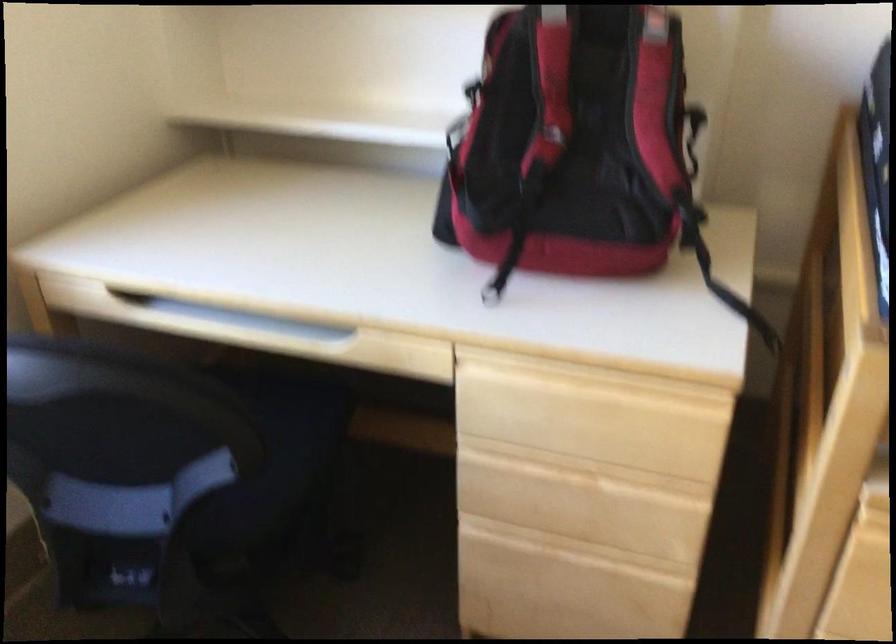
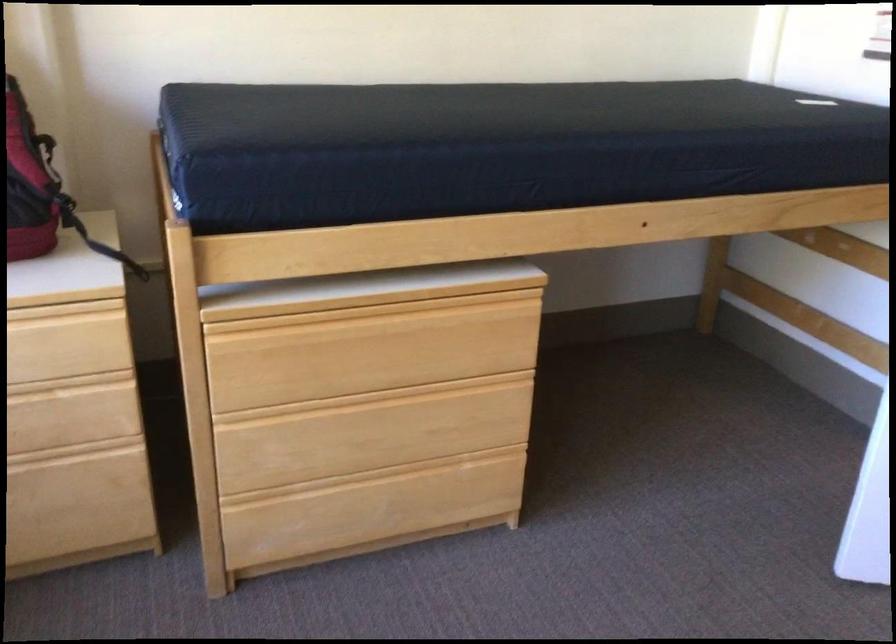
Locate, in the second image, the point that corresponds to (633,426) in the first image.

(67, 348)